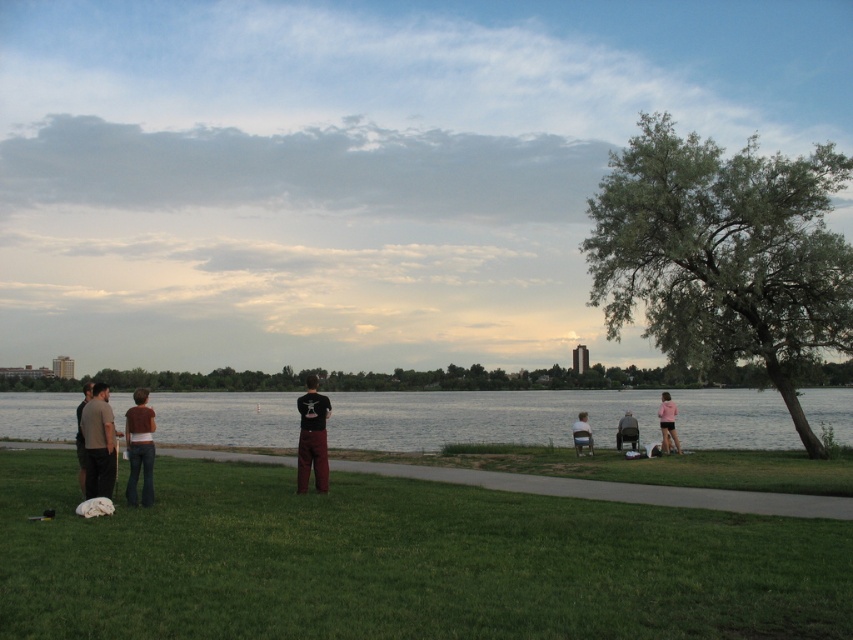
Is point (86, 388) closer to viewer compared to point (619, 429)?

Yes, it is.

Between point (86, 392) and point (628, 416), which one is positioned in front?

Point (86, 392) is in front.

Does point (80, 426) come closer to viewer compared to point (627, 422)?

Yes, point (80, 426) is closer to viewer.

Where is `dark gray pants at left`? dark gray pants at left is located at coordinates (80, 435).

Based on the photo, which is more to the right, green grass at lower center or dark gray fabric bag at lower center?

dark gray fabric bag at lower center

Is point (312, 625) farther from camera compared to point (616, 440)?

No, (312, 625) is closer to viewer.

The image size is (853, 640). Identify the location of green grass at lower center. (399, 561).

Which is more to the right, blue water at center or smooth black shirt at center?

From the viewer's perspective, smooth black shirt at center appears more on the right side.

Does point (268, 417) come in front of point (579, 442)?

No, it is behind (579, 442).

This screenshot has height=640, width=853. In order to click on blue water at center in this screenshot , I will do `click(482, 417)`.